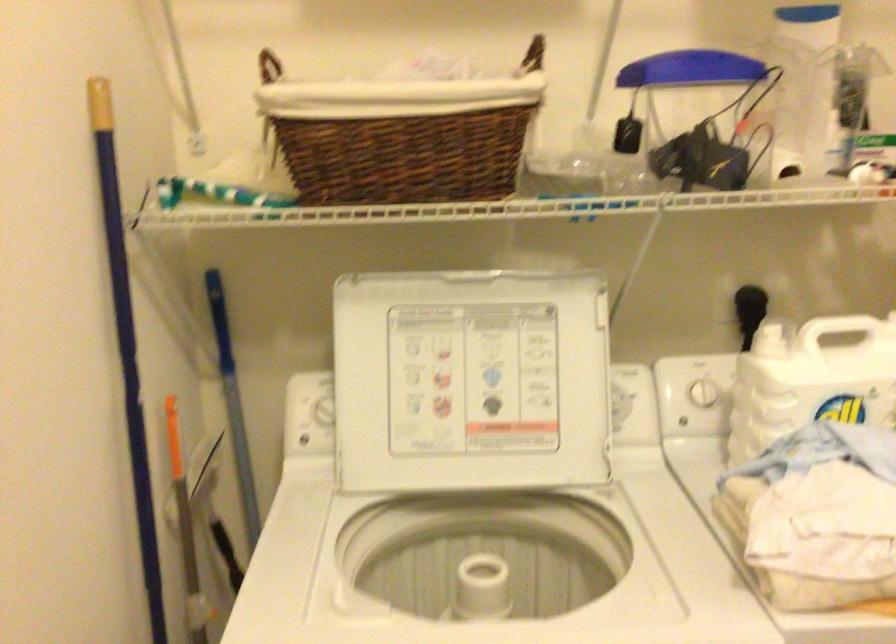
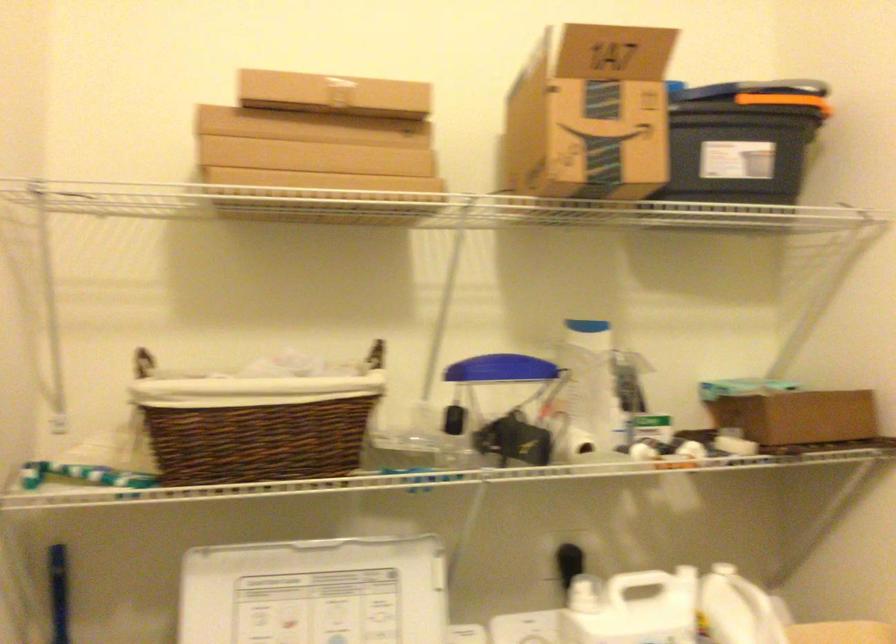
Question: Which direction would the cameraman need to move to produce the second image? Reply with the corresponding letter.

Choices:
 (A) Left
 (B) Right
 (C) Forward
 (D) Backward

Answer: (D)